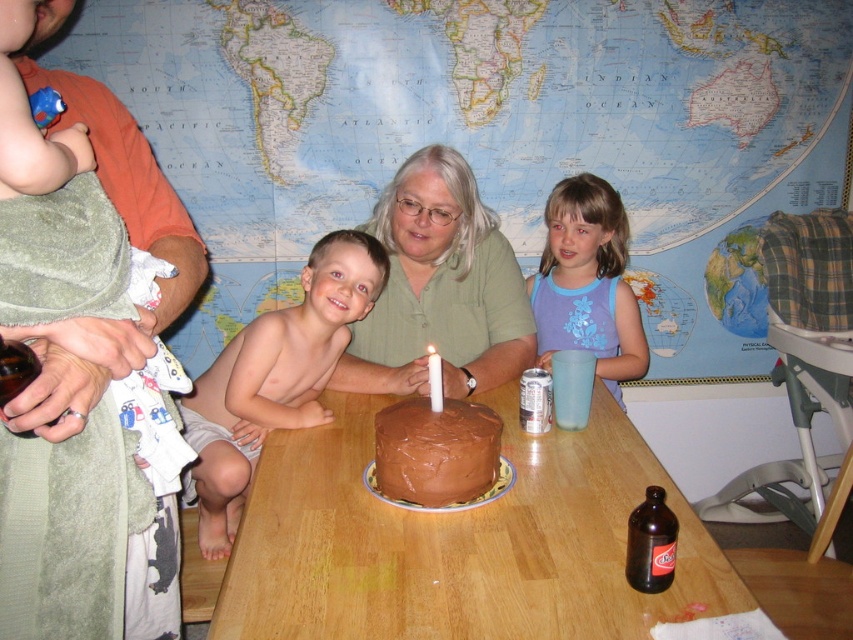
Question: Is blue cotton shirt at upper right below white wax candle at center?

Choices:
 (A) yes
 (B) no

Answer: (B)

Question: Which object is positioned closest to the smooth skin boy at center?

Choices:
 (A) white wax candle at center
 (B) chocolate matte cake at center

Answer: (B)

Question: Considering the relative positions of brown wooden table at center and white wax candle at center in the image provided, where is brown wooden table at center located with respect to white wax candle at center?

Choices:
 (A) above
 (B) below

Answer: (B)

Question: Can you confirm if brown wooden table at center is smaller than blue cotton shirt at upper right?

Choices:
 (A) yes
 (B) no

Answer: (B)

Question: Which object is positioned farthest from the soft cotton towel at upper left?

Choices:
 (A) green matte shirt at center
 (B) white wax candle at center
 (C) chocolate matte cake at center
 (D) blue cotton shirt at upper right

Answer: (D)

Question: Which point appears farthest from the camera in this image?

Choices:
 (A) (346, 232)
 (B) (688, 557)
 (C) (601, 193)

Answer: (C)